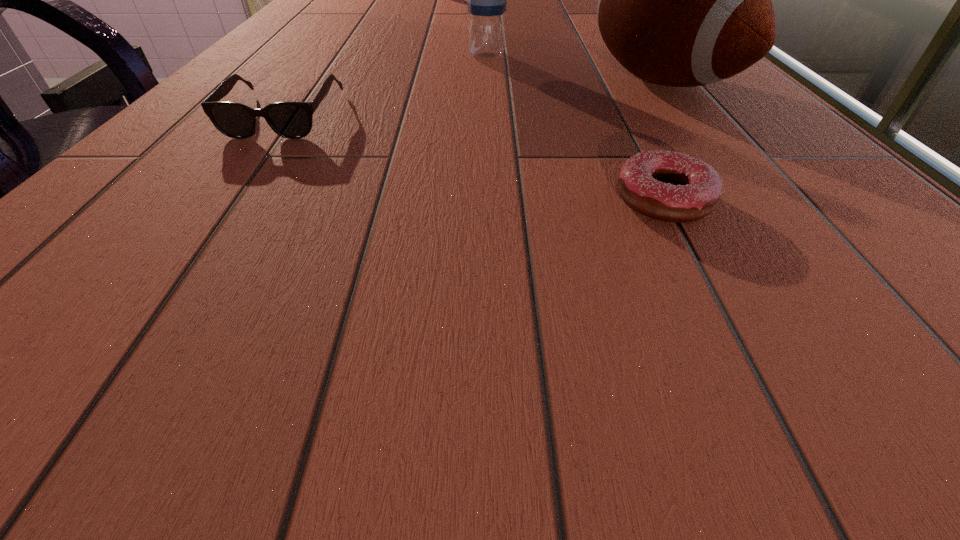
The image size is (960, 540). I want to click on free space between the football and the third object from right to left, so click(572, 69).

The height and width of the screenshot is (540, 960). I want to click on unoccupied area between the leftmost object and the football, so click(x=471, y=98).

Locate an element on the screen. The height and width of the screenshot is (540, 960). vacant area that lies between the second object from left to right and the leftmost object is located at coordinates (386, 86).

In order to click on empty space that is in between the nearest object and the sunglasses in this screenshot , I will do `click(474, 158)`.

Where is `free area in between the nearest object and the football`? The width and height of the screenshot is (960, 540). free area in between the nearest object and the football is located at coordinates (661, 140).

The width and height of the screenshot is (960, 540). I want to click on free point between the leftmost object and the football, so click(471, 98).

Choose which object is the nearest neighbor to the sunglasses. Please provide its 2D coordinates. Your answer should be formatted as a tuple, i.e. [(x, y)], where the tuple contains the x and y coordinates of a point satisfying the conditions above.

[(487, 0)]

Select which object appears as the closest to the football. Please provide its 2D coordinates. Your answer should be formatted as a tuple, i.e. [(x, y)], where the tuple contains the x and y coordinates of a point satisfying the conditions above.

[(487, 0)]

Locate an element on the screen. vacant space that satisfies the following two spatial constraints: 1. on the front side of the second object from left to right; 2. on the right side of the shortest object is located at coordinates (492, 200).

What are the coordinates of `free space that satisfies the following two spatial constraints: 1. on the back side of the football; 2. on the left side of the doughnut` in the screenshot? It's located at (601, 81).